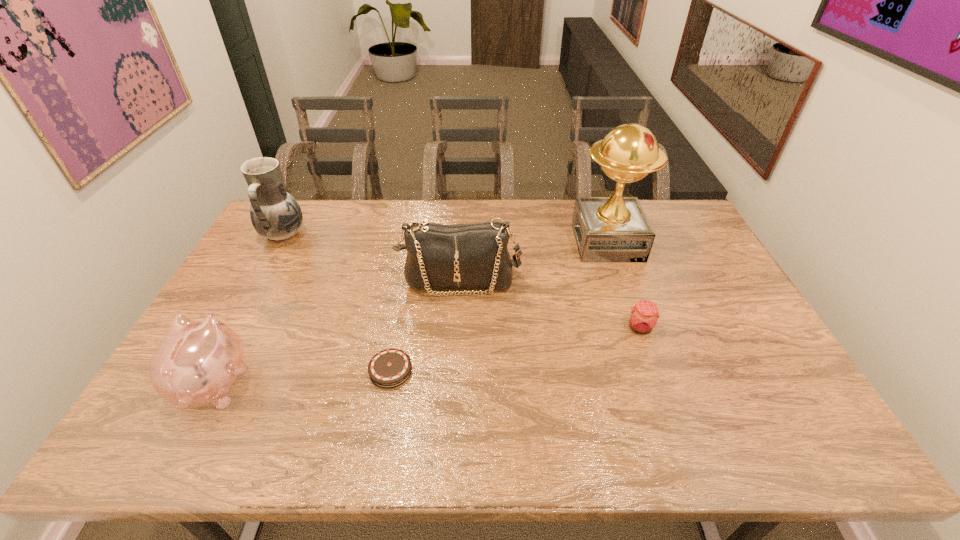
Find the location of `award`. award is located at coordinates (607, 229).

You are a GUI agent. You are given a task and a screenshot of the screen. Output one action in this format:
    pyautogui.click(x=<x>, y=<y>)
    Task: Click on the pitcher
    The width and height of the screenshot is (960, 540).
    Given the screenshot: What is the action you would take?
    pyautogui.click(x=275, y=214)

Identify the location of handbag. Image resolution: width=960 pixels, height=540 pixels. (462, 256).

At what (x,y) coordinates should I click in order to perform the action: click on the fourth nearest object. Please return your answer as a coordinate pair (x, y). This screenshot has height=540, width=960. Looking at the image, I should click on (462, 256).

Identify the location of piggy bank. (197, 362).

You are a GUI agent. You are given a task and a screenshot of the screen. Output one action in this format:
    pyautogui.click(x=<x>, y=<y>)
    Task: Click on the third nearest object
    The image size is (960, 540).
    Given the screenshot: What is the action you would take?
    pyautogui.click(x=643, y=318)

What are the coordinates of `jam` in the screenshot? It's located at (643, 318).

Locate an element on the screen. The width and height of the screenshot is (960, 540). chocolate cake is located at coordinates (389, 368).

This screenshot has height=540, width=960. Find the location of `vacant space situated 0.390m on the front-facing side of the award`. vacant space situated 0.390m on the front-facing side of the award is located at coordinates (461, 242).

The height and width of the screenshot is (540, 960). I want to click on free location located 0.130m on the front-facing side of the award, so click(537, 242).